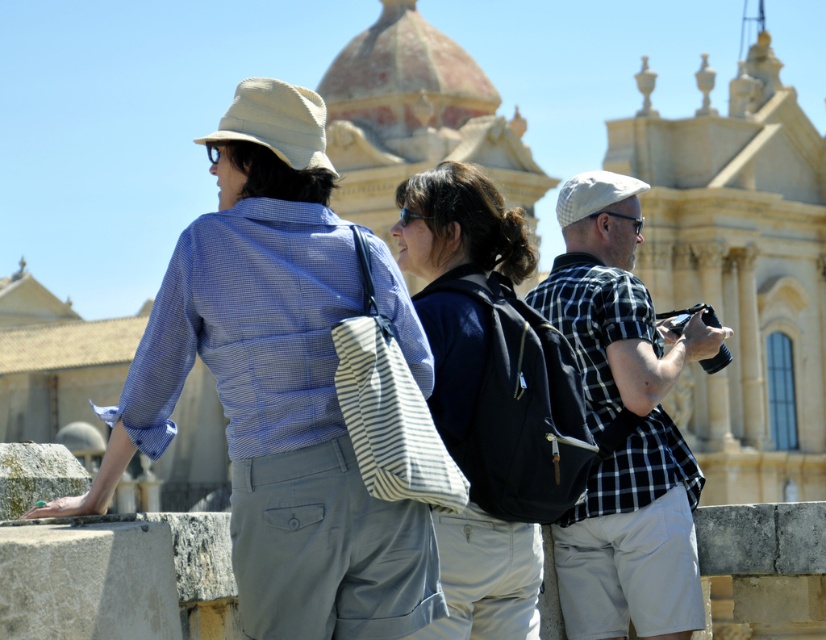
Can you confirm if dark blue backpack at center is shorter than checkered fabric shirt at center?

No.

Between dark blue backpack at center and checkered fabric shirt at center, which one is positioned lower?

checkered fabric shirt at center

Is point (506, 595) closer to viewer compared to point (656, 624)?

Yes, point (506, 595) is closer to viewer.

Where is `dark blue backpack at center`? The image size is (826, 640). dark blue backpack at center is located at coordinates (x=491, y=397).

Is matte blue shirt at center smaller than dark blue backpack at center?

Yes, matte blue shirt at center is smaller than dark blue backpack at center.

Describe the element at coordinates (274, 387) in the screenshot. This screenshot has height=640, width=826. I see `matte blue shirt at center` at that location.

Measure the distance between point (259, 90) and camera.

The distance of point (259, 90) from camera is 48.65 meters.

At what (x,y) coordinates should I click in order to perform the action: click on matte blue shirt at center. Please return your answer as a coordinate pair (x, y). This screenshot has width=826, height=640. Looking at the image, I should click on (274, 387).

Does matte blue shirt at center appear under checkered fabric shirt at center?

Indeed, matte blue shirt at center is positioned under checkered fabric shirt at center.

Measure the distance between matte blue shirt at center and camera.

matte blue shirt at center and camera are 43.56 meters apart.

Who is more forward, (411, 589) or (629, 188)?

Point (411, 589) is more forward.

The height and width of the screenshot is (640, 826). What are the coordinates of `matte blue shirt at center` in the screenshot? It's located at (274, 387).